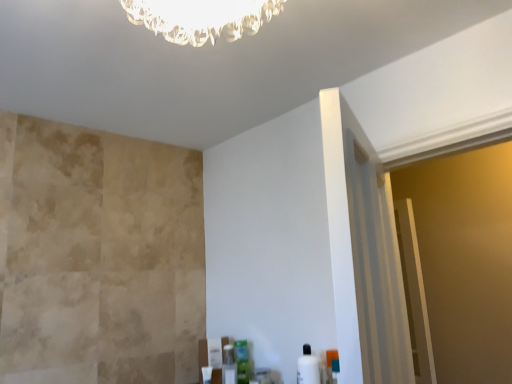
Question: From the image's perspective, relative to green plastic container at lower center, the 2th toiletry positioned from the front, is white glossy bottle at lower right, the third toiletry in the left-to-right sequence, above or below?

Choices:
 (A) below
 (B) above

Answer: (B)

Question: Considering the positions of point (309, 354) and point (245, 345), is point (309, 354) closer or farther from the camera than point (245, 345)?

Choices:
 (A) closer
 (B) farther

Answer: (A)

Question: Which object is the closest to the clear plastic bottle at lower center, the first toiletry viewed from the back?

Choices:
 (A) white glossy bottle at lower right, which ranks as the 3th toiletry in back-to-front order
 (B) green plastic container at lower center, which appears as the 2th toiletry when viewed from the right

Answer: (B)

Question: Which object is the closest to the green plastic container at lower center, which appears as the 2th toiletry when viewed from the right?

Choices:
 (A) clear plastic bottle at lower center, the 3th toiletry when ordered from front to back
 (B) white glossy bottle at lower right, which ranks as the 3th toiletry in back-to-front order

Answer: (A)